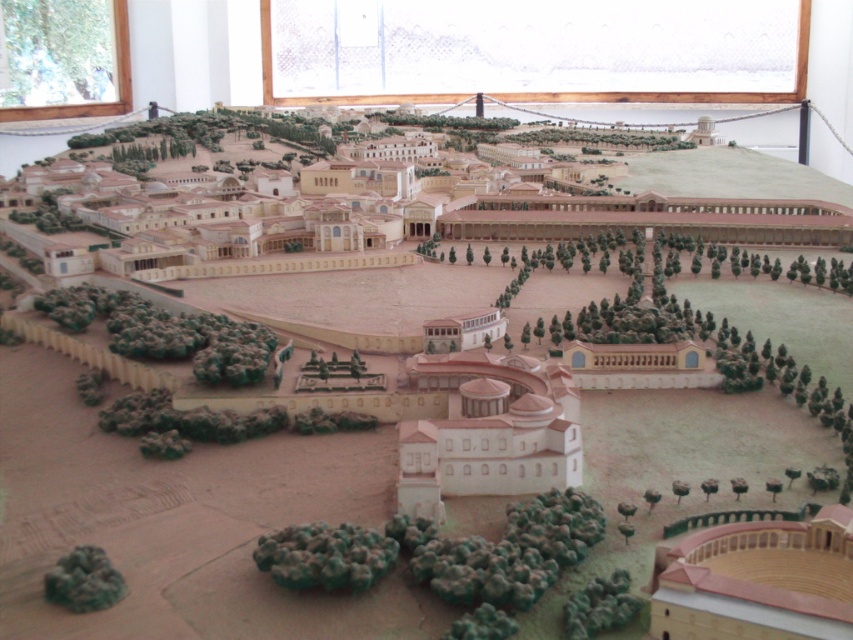
Question: Can you confirm if white matte building at center is positioned above green matte tree at lower left?

Choices:
 (A) yes
 (B) no

Answer: (A)

Question: Estimate the real-world distances between objects in this image. Which object is closer to the green matte tree at lower left?

Choices:
 (A) white matte building at center
 (B) green matte tree at upper left
 (C) light brown clay amphitheater at lower right

Answer: (A)

Question: Is white matte building at center to the left of green matte tree at lower left from the viewer's perspective?

Choices:
 (A) yes
 (B) no

Answer: (B)

Question: Among these points, which one is farthest from the camera?

Choices:
 (A) (576, 592)
 (B) (541, 429)

Answer: (B)

Question: Considering the relative positions of white matte building at center and green matte tree at upper left in the image provided, where is white matte building at center located with respect to green matte tree at upper left?

Choices:
 (A) right
 (B) left

Answer: (A)

Question: Among these points, which one is nearest to the camera?

Choices:
 (A) (590, 602)
 (B) (215, 353)
 (C) (709, 602)

Answer: (C)